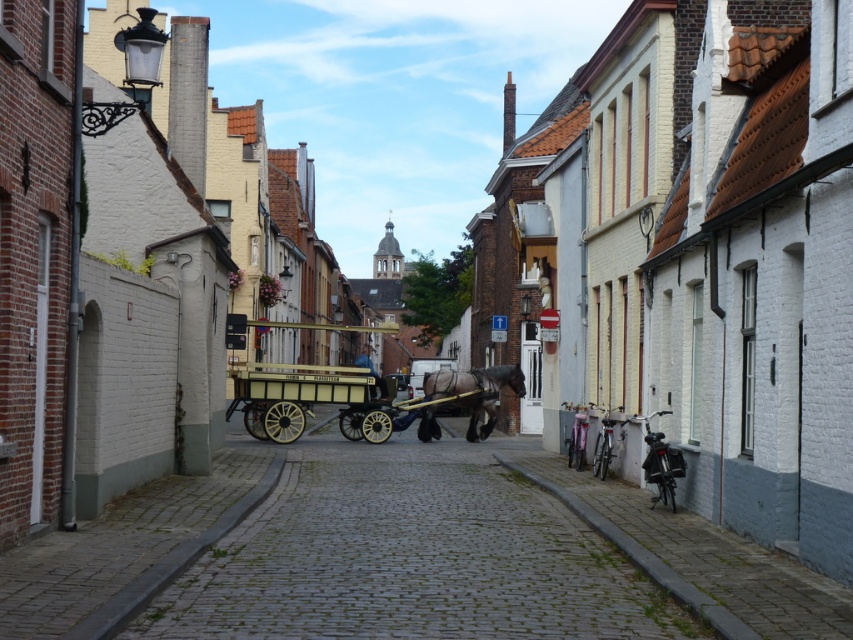
You are a tour guide leading a group down this cobblestone street. You need to move a 10 feet long banner between the wooden polished cart at center and dark brown glossy horse at center. Is there enough space for the banner to pass through?

The distance between the wooden polished cart at center and dark brown glossy horse at center is 8.65 feet, which is shorter than the 10 feet long banner. Therefore, the banner cannot pass through the space between them.

You are standing on the cobblestone street and want to board the wooden polished cart at center and the wooden polished coach at center. Which one is higher up and easier to step into?

The wooden polished cart at center is above the wooden polished coach at center, so it is higher up and easier to step into.

You are a tourist standing on the cobblestone street and want to take a photo of both the dark brown glossy horse at center and the wooden polished coach at center. Which object should you position closer to the left side of your camera frame to include both in the photo?

Since the dark brown glossy horse at center is to the right of the wooden polished coach at center, you should position the wooden polished coach at center closer to the left side of your camera frame to include both in the photo.